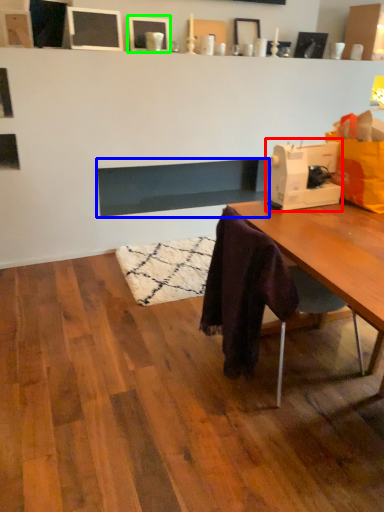
Question: Estimate the real-world distances between objects in this image. Which object is closer to sewing machine (highlighted by a red box), fireplace (highlighted by a blue box) or picture frame (highlighted by a green box)?

Choices:
 (A) fireplace
 (B) picture frame

Answer: (A)